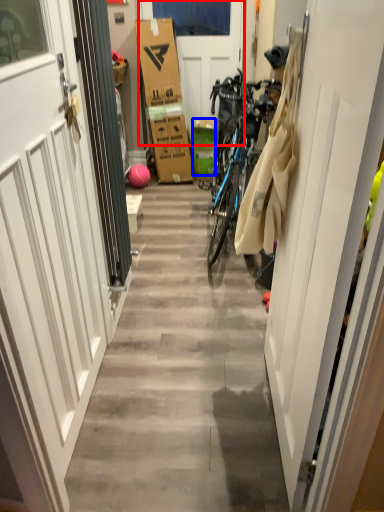
Question: Which object is closer to the camera taking this photo, door (highlighted by a red box) or box (highlighted by a blue box)?

Choices:
 (A) door
 (B) box

Answer: (A)